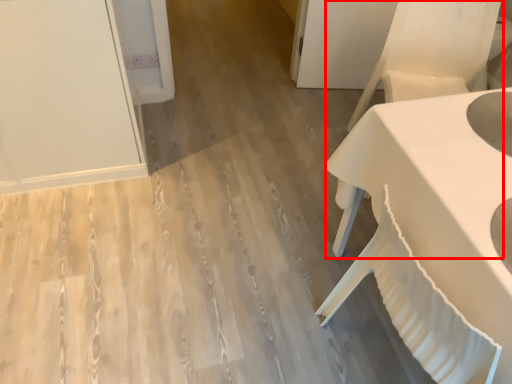
Question: From the image, what is the correct spatial relationship of armchair (annotated by the red box) in relation to table?

Choices:
 (A) right
 (B) left

Answer: (A)